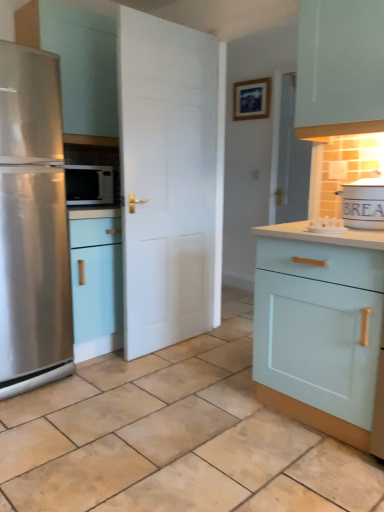
I want to click on free spot in front of white matte door at center, so click(x=162, y=370).